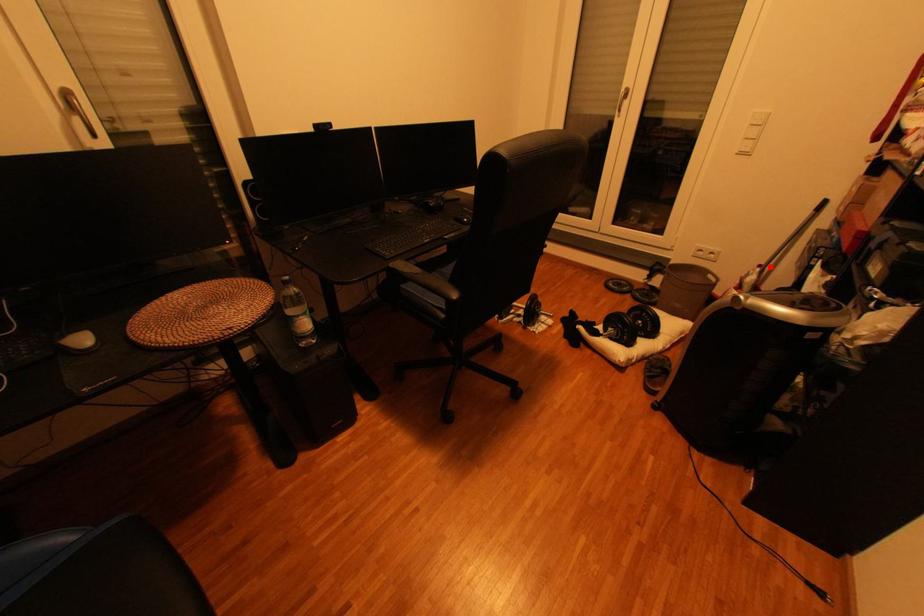
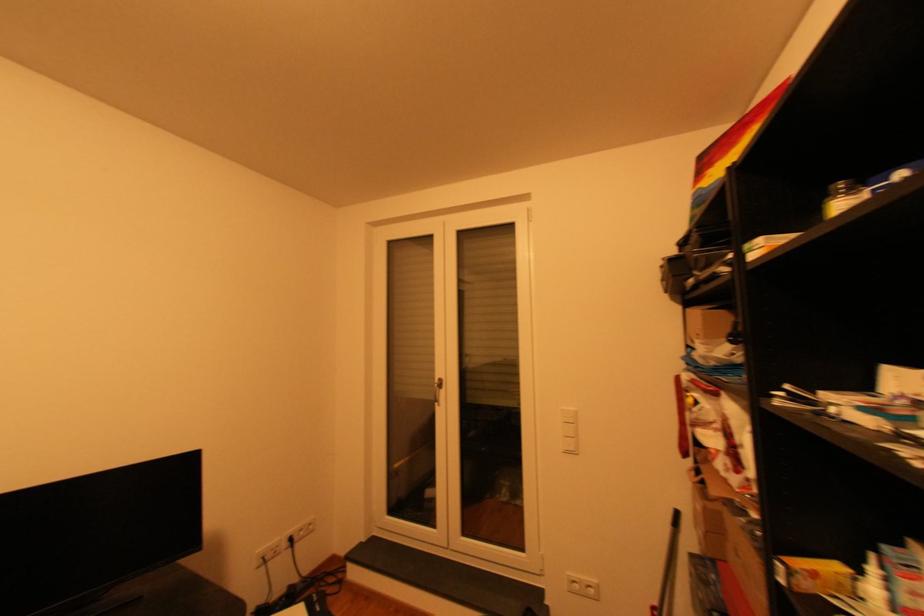
Locate, in the second image, the point that corresponds to the highlighted location in the first image.

(662, 608)